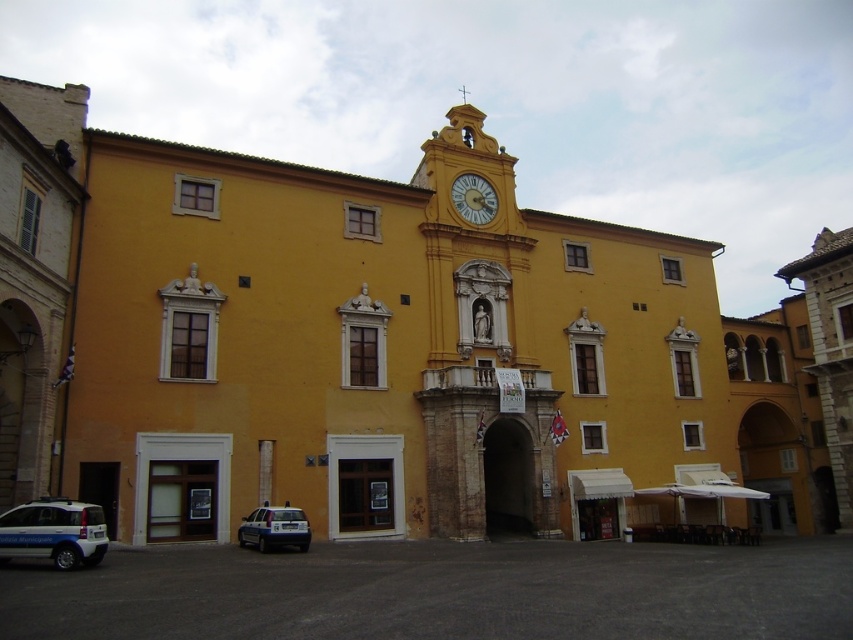
Question: Considering the real-world distances, which object is closest to the white glossy police car at lower left?

Choices:
 (A) golden metallic clock at upper center
 (B) white glossy car at lower left

Answer: (B)

Question: Can you confirm if white glossy police car at lower left is bigger than golden metallic clock at upper center?

Choices:
 (A) yes
 (B) no

Answer: (B)

Question: Is white glossy car at lower left above white glossy police car at lower left?

Choices:
 (A) no
 (B) yes

Answer: (B)

Question: Among these points, which one is farthest from the camera?

Choices:
 (A) (306, 544)
 (B) (474, 182)

Answer: (B)

Question: Is white glossy car at lower left bigger than white glossy police car at lower left?

Choices:
 (A) no
 (B) yes

Answer: (B)

Question: Which point is closer to the camera taking this photo?

Choices:
 (A) (454, 193)
 (B) (287, 541)

Answer: (B)